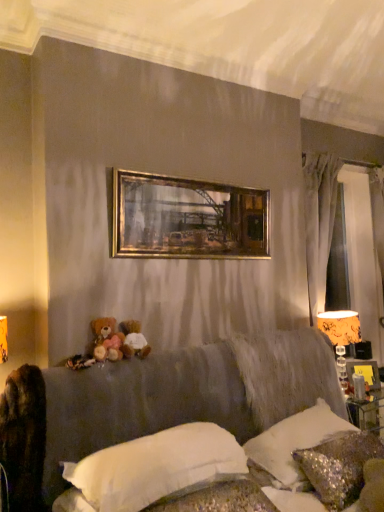
Question: Can you confirm if gold metallic picture frame at upper center is shorter than orange fabric lampshade at right?

Choices:
 (A) no
 (B) yes

Answer: (B)

Question: Is gold metallic picture frame at upper center to the right of orange fabric lampshade at right from the viewer's perspective?

Choices:
 (A) yes
 (B) no

Answer: (B)

Question: Are gold metallic picture frame at upper center and orange fabric lampshade at right making contact?

Choices:
 (A) no
 (B) yes

Answer: (A)

Question: Are gold metallic picture frame at upper center and orange fabric lampshade at right far apart?

Choices:
 (A) no
 (B) yes

Answer: (B)

Question: Could orange fabric lampshade at right be considered to be inside gold metallic picture frame at upper center?

Choices:
 (A) yes
 (B) no

Answer: (B)

Question: In the image, is white soft pillow at center, acting as the 3th pillow starting from the right, positioned in front of or behind satin sequined pillow at lower right, which is the 2th pillow in right-to-left order?

Choices:
 (A) behind
 (B) front

Answer: (B)

Question: Considering the positions of point (94, 468) and point (276, 429), is point (94, 468) closer or farther from the camera than point (276, 429)?

Choices:
 (A) closer
 (B) farther

Answer: (A)

Question: In the image, is white soft pillow at center, acting as the 3th pillow starting from the right, on the left side or the right side of satin sequined pillow at lower right, which is the 2th pillow in right-to-left order?

Choices:
 (A) left
 (B) right

Answer: (A)

Question: In terms of width, does white soft pillow at center, acting as the 3th pillow starting from the right, look wider or thinner when compared to satin sequined pillow at lower right, arranged as the second pillow when viewed from the left?

Choices:
 (A) thin
 (B) wide

Answer: (B)

Question: Is white soft pillow at center, acting as the 3th pillow starting from the right, bigger or smaller than gold metallic picture frame at upper center?

Choices:
 (A) small
 (B) big

Answer: (B)

Question: Is point (56, 498) positioned closer to the camera than point (145, 193)?

Choices:
 (A) closer
 (B) farther

Answer: (A)

Question: Is white soft pillow at center, acting as the 3th pillow starting from the right, situated inside gold metallic picture frame at upper center or outside?

Choices:
 (A) outside
 (B) inside

Answer: (A)

Question: From a real-world perspective, is white soft pillow at center, which ranks as the first pillow in left-to-right order, positioned above or below gold metallic picture frame at upper center?

Choices:
 (A) above
 (B) below

Answer: (B)

Question: Would you say brown plush toy at lower left, placed as the first toy when sorted from right to left, is to the left or to the right of gold metallic picture frame at upper center in the picture?

Choices:
 (A) left
 (B) right

Answer: (A)

Question: From the image's perspective, relative to gold metallic picture frame at upper center, is brown plush toy at lower left, the 2th toy positioned from the left, above or below?

Choices:
 (A) above
 (B) below

Answer: (B)